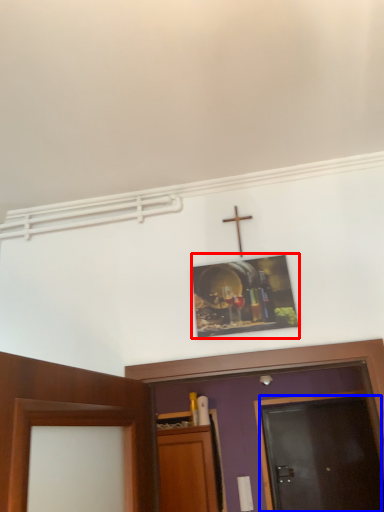
Question: Which point is further to the camera, picture frame (highlighted by a red box) or door (highlighted by a blue box)?

Choices:
 (A) picture frame
 (B) door

Answer: (B)